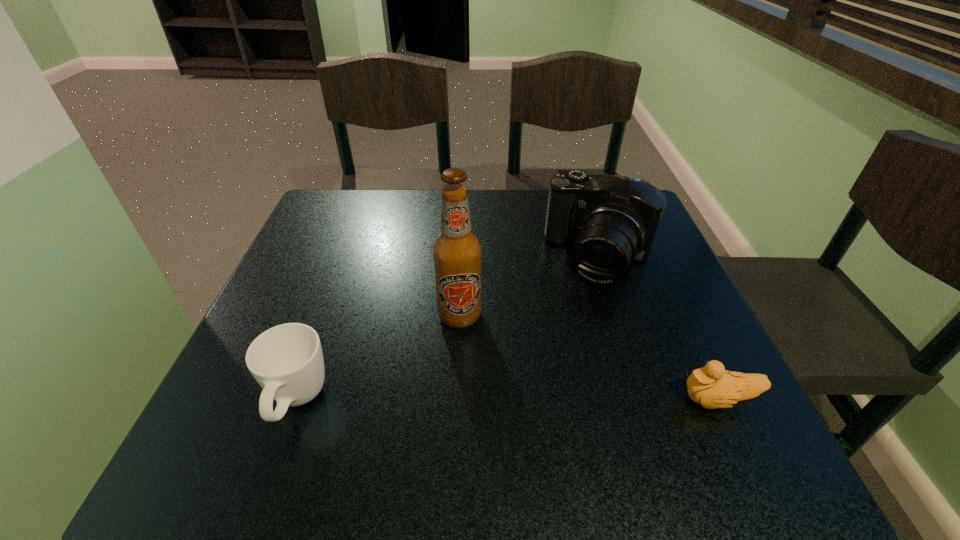
Image resolution: width=960 pixels, height=540 pixels. Find the location of `the leftmost object`. the leftmost object is located at coordinates (287, 361).

Locate an element on the screen. duckling is located at coordinates (712, 386).

Locate an element on the screen. The image size is (960, 540). the farthest object is located at coordinates (613, 219).

Locate an element on the screen. camera is located at coordinates (613, 219).

In order to click on beer bottle in this screenshot , I will do `click(456, 252)`.

In order to click on the third nearest object in this screenshot , I will do `click(456, 252)`.

Where is `vacant region located on the face of the shortest object`? This screenshot has width=960, height=540. vacant region located on the face of the shortest object is located at coordinates (556, 400).

At what (x,y) coordinates should I click in order to perform the action: click on vacant space located 0.210m on the face of the shortest object. Please return your answer as a coordinate pair (x, y). This screenshot has height=540, width=960. Looking at the image, I should click on (556, 400).

This screenshot has height=540, width=960. I want to click on vacant space located 0.310m on the face of the shortest object, so click(496, 400).

Locate an element on the screen. free space located 0.110m on the lens of the farthest object is located at coordinates (569, 324).